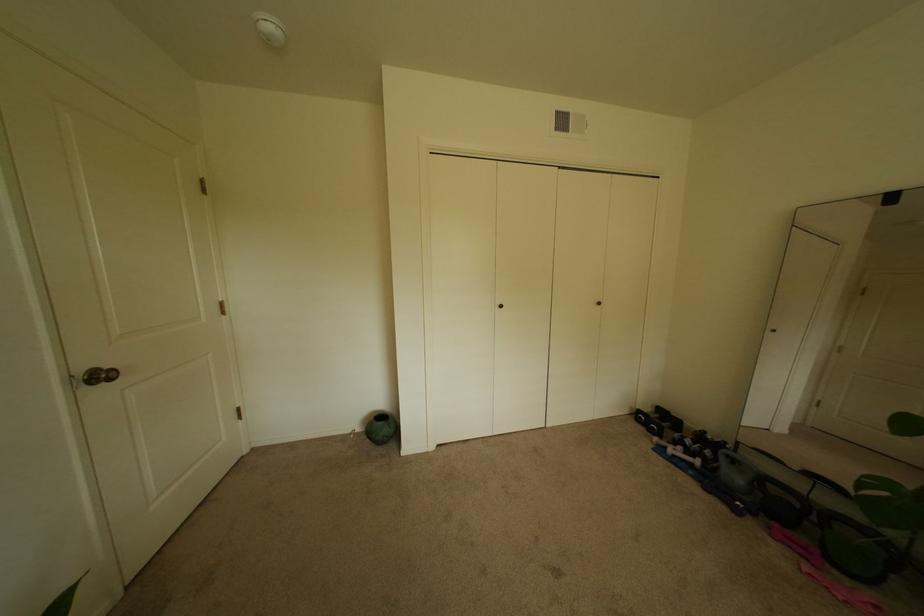
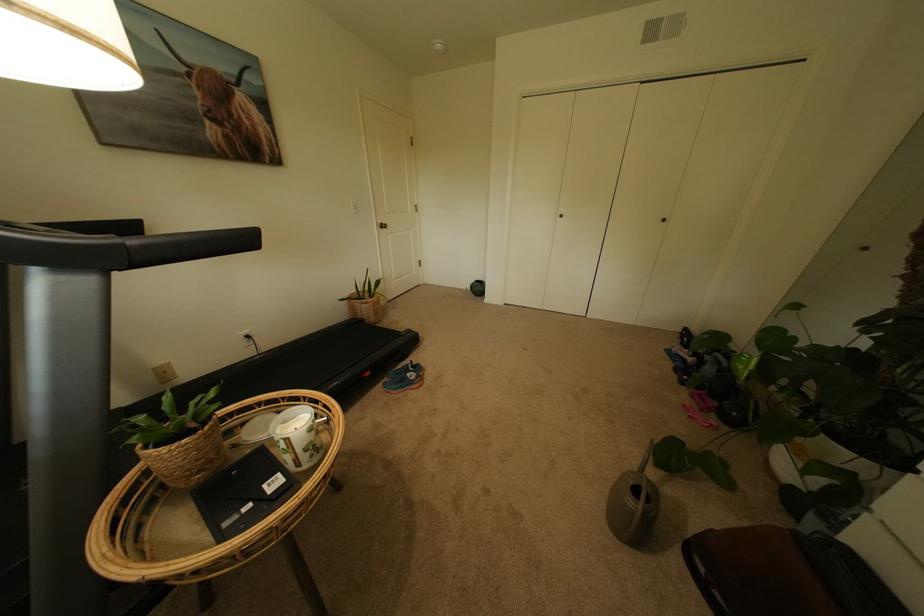
In the second image, find the point that corresponds to [119,381] in the first image.

(394, 229)